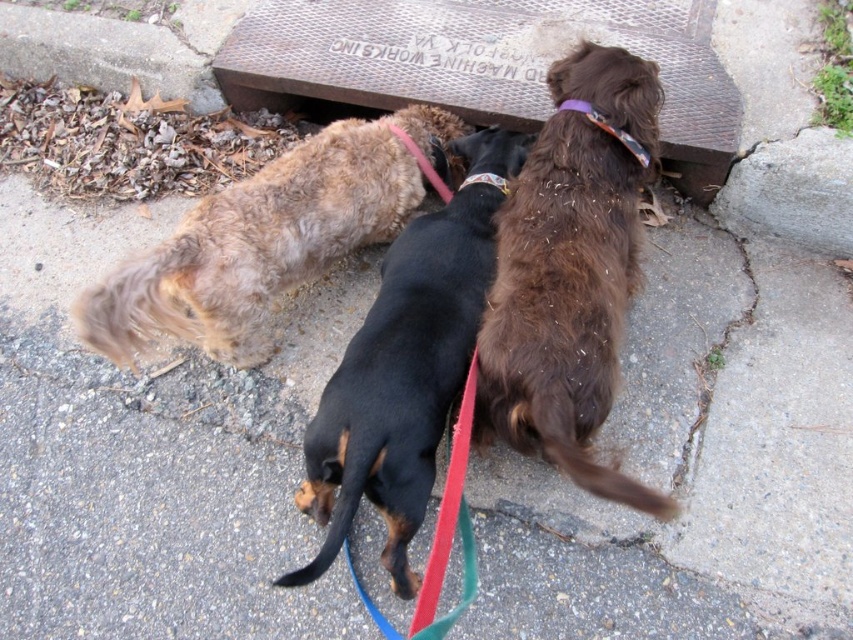
You are a dog owner who wants to ensure your pets are safe. You notice the brown fuzzy dog at center and the multicolored fabric collar at center. Which object is higher up in the image?

The brown fuzzy dog at center is much taller than the multicolored fabric collar at center, so the brown fuzzy dog at center is higher up in the image.

You are standing at the origin point of the coordinate system where the image is displayed. You see three dogs from behind. The black smooth dachshund at center is located at point (399,384). Can you confirm the exact coordinates of the black smooth dachshund at center?

The black smooth dachshund at center is located at point (399,384).

You are a dog owner trying to fit a new collar onto your brown fuzzy dog at center. The collar you have is the multicolored fabric collar at center. Based on the image, will the collar fit properly around the dog?

The brown fuzzy dog at center is wider than the multicolored fabric collar at center, so the collar may be too small to fit properly around the dog.